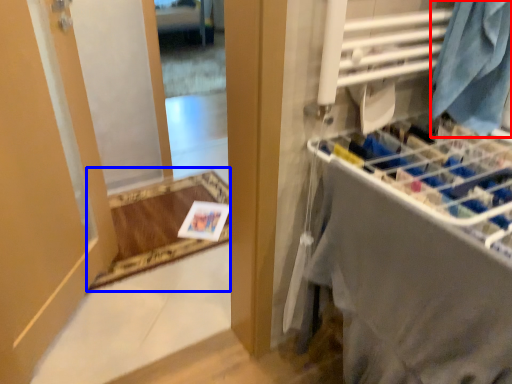
Question: Which of the following is the closest to the observer, clothing (highlighted by a red box) or mat (highlighted by a blue box)?

Choices:
 (A) clothing
 (B) mat

Answer: (A)